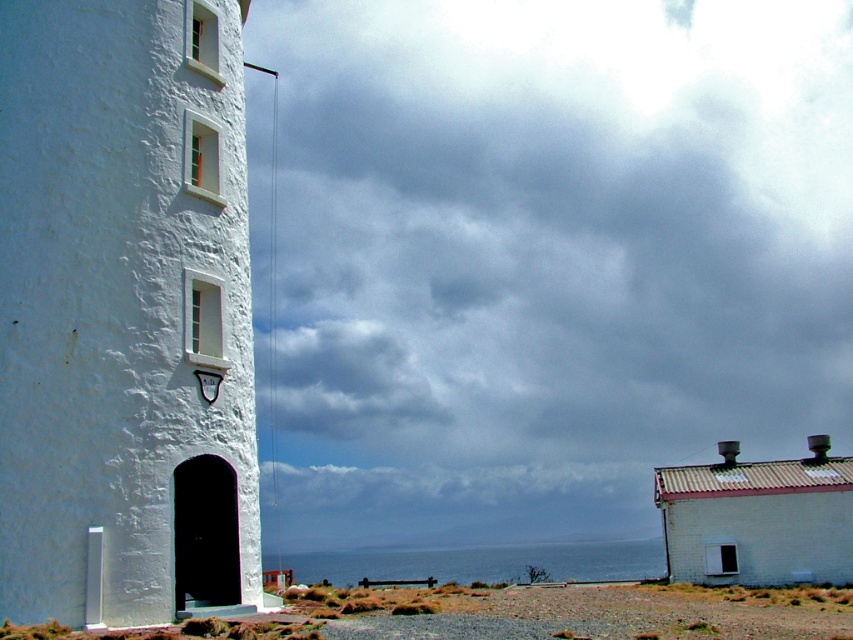
Looking at the coastal scene, which object occupies a bigger area in the image between the cloudy sky at upper center and the white stucco tower at left?

The cloudy sky at upper center is larger in size than the white stucco tower at left, so it occupies a bigger area in the image.

You are a painter wanting to capture the coastal scene. You notice the cloudy sky at upper center and the white stucco tower at left. Which object occupies a larger portion of the image horizontally?

The cloudy sky at upper center might be wider than white stucco tower at left, so the cloudy sky at upper center likely occupies a larger horizontal portion in the image.

You are standing in front of the lighthouse and looking up at the cloudy sky at upper center. There is a point marked at coordinates (550,257). Is this point located on the cloudy sky at upper center?

Yes, the point (550,257) is on cloudy sky at upper center.